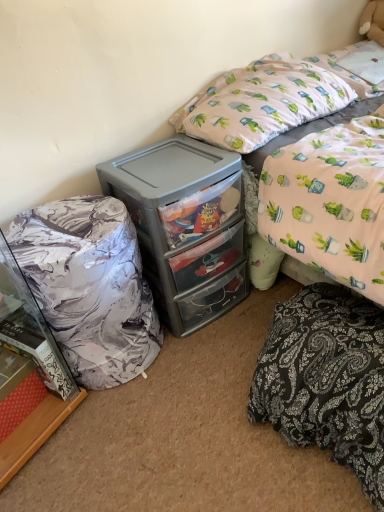
Image resolution: width=384 pixels, height=512 pixels. What are the coordinates of `vacant area that lies to the right of marble-patterned bean bag at left` in the screenshot? It's located at (210, 362).